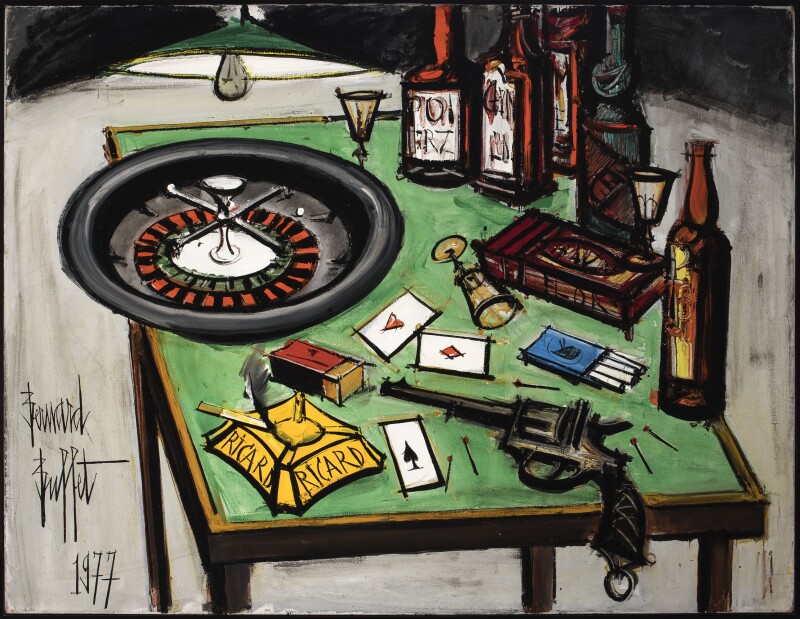
Locate an element on the screen. The width and height of the screenshot is (800, 619). light bulb is located at coordinates (234, 75).